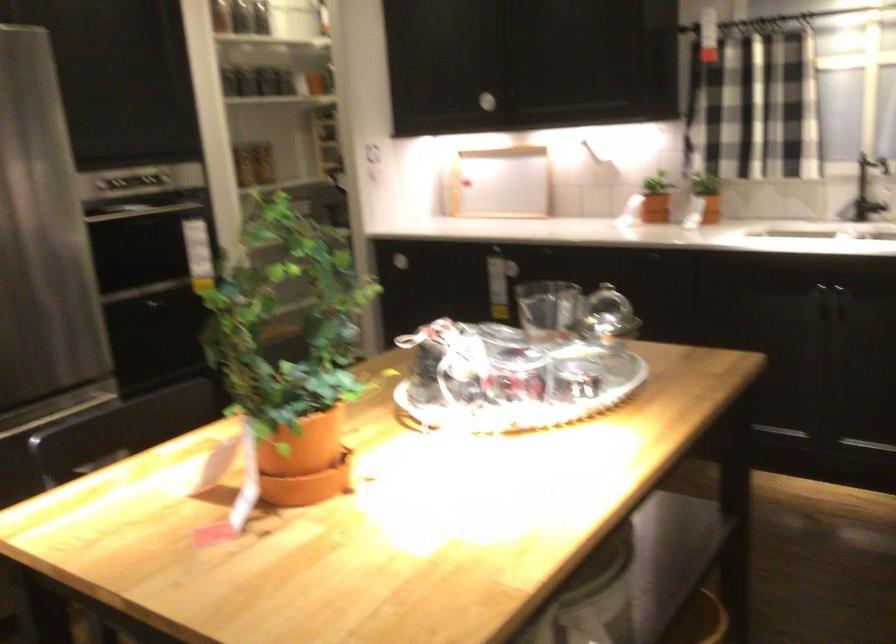
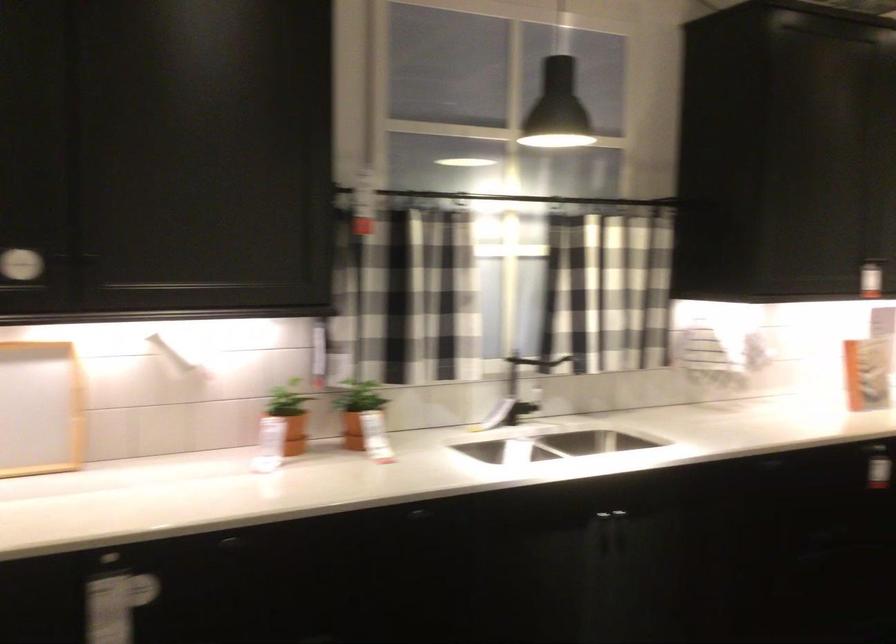
Find the pixel in the second image that matches (703,185) in the first image.

(357, 410)